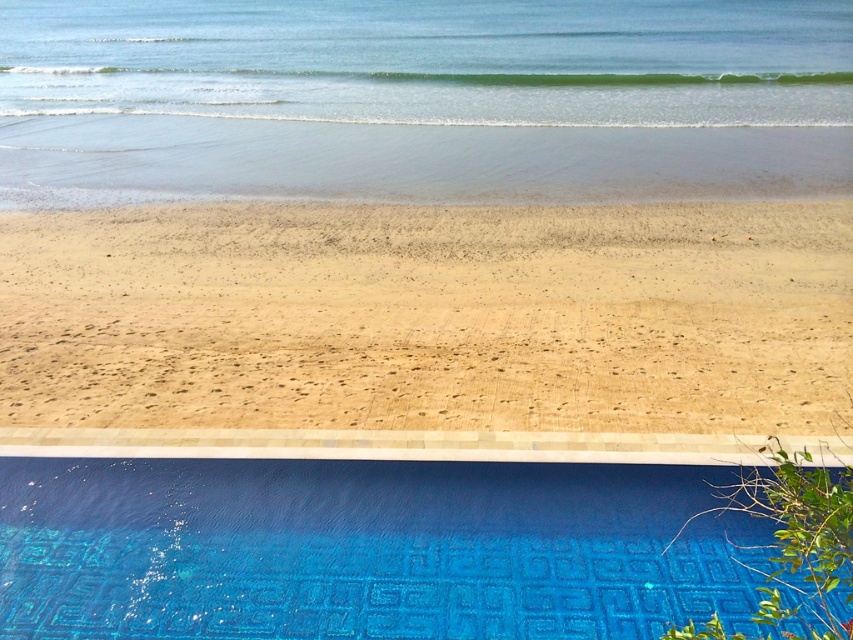
Can you confirm if brown sandy beach at center is bigger than clear blue water at upper center?

Actually, brown sandy beach at center might be smaller than clear blue water at upper center.

Which is in front, point (396, 211) or point (527, 106)?

Point (396, 211)

The height and width of the screenshot is (640, 853). In order to click on brown sandy beach at center in this screenshot , I will do `click(428, 317)`.

Does brown sandy beach at center have a greater height compared to blue glossy tile at lower center?

Yes.

Which of these two, brown sandy beach at center or blue glossy tile at lower center, stands shorter?

blue glossy tile at lower center

This screenshot has height=640, width=853. What do you see at coordinates (428, 317) in the screenshot?
I see `brown sandy beach at center` at bounding box center [428, 317].

Where is `brown sandy beach at center`? This screenshot has width=853, height=640. brown sandy beach at center is located at coordinates (428, 317).

Who is lower down, blue glossy tile at lower center or clear blue water at upper center?

blue glossy tile at lower center is below.

Can you confirm if blue glossy tile at lower center is shorter than clear blue water at upper center?

Yes, blue glossy tile at lower center is shorter than clear blue water at upper center.

Which is behind, point (693, 500) or point (763, 109)?

Positioned behind is point (763, 109).

The height and width of the screenshot is (640, 853). I want to click on blue glossy tile at lower center, so click(x=368, y=548).